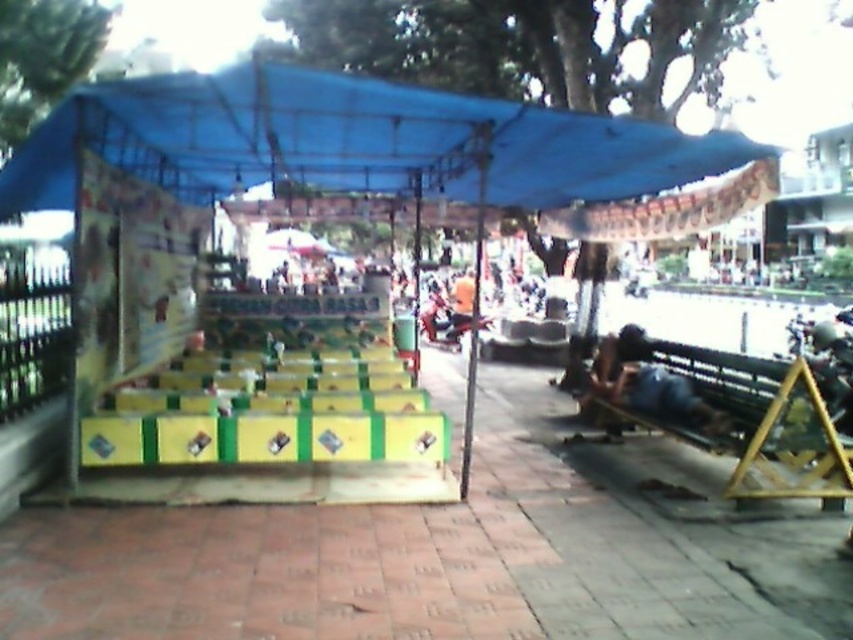
What are the coordinates of the blue fabric tent at center in the image?

The blue fabric tent at center is located at coordinates (352, 144).

You are a performer who needs to set up a 4.5 feet wide equipment cart between the blue fabric tent at center and the dark blue fabric at lower right. Can you fit the cart in the space between them?

The distance between the blue fabric tent at center and the dark blue fabric at lower right is 5.49 feet, which is wider than the 4.5 feet width of the equipment cart. Therefore, the cart can fit between them.